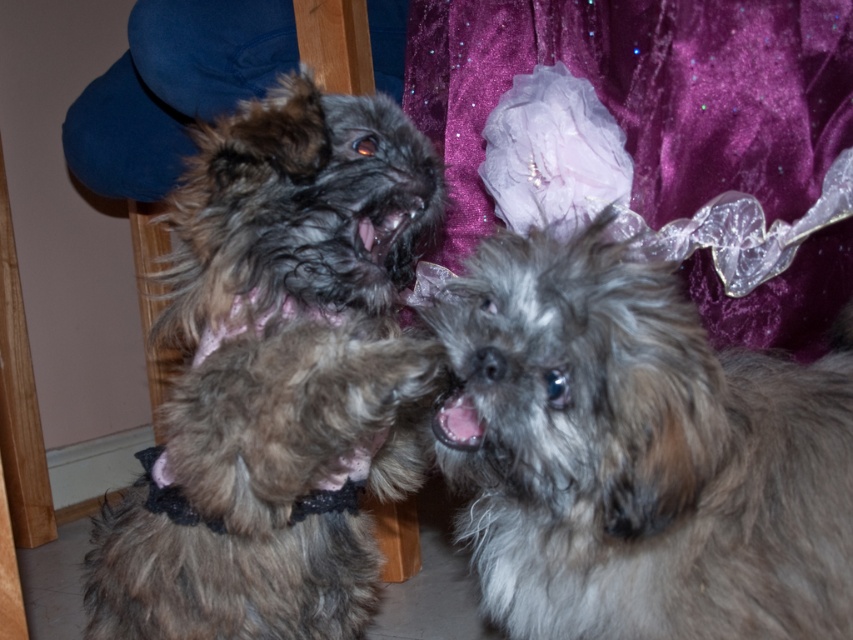
Question: Is fuzzy gray dog at center to the left of fuzzy brown fur at center from the viewer's perspective?

Choices:
 (A) yes
 (B) no

Answer: (B)

Question: Can you confirm if fuzzy gray dog at center is positioned to the left of fuzzy brown fur at center?

Choices:
 (A) no
 (B) yes

Answer: (A)

Question: Is fuzzy gray dog at center further to camera compared to fuzzy brown fur at center?

Choices:
 (A) yes
 (B) no

Answer: (B)

Question: Which point is closer to the camera?

Choices:
 (A) (219, 534)
 (B) (612, 445)

Answer: (B)

Question: Which point appears closest to the camera in this image?

Choices:
 (A) (213, 276)
 (B) (606, 598)

Answer: (B)